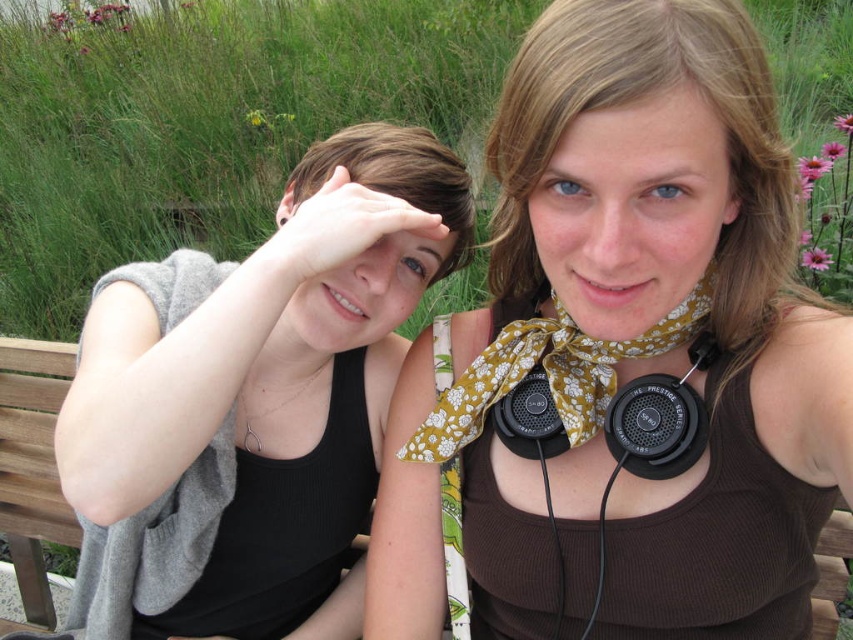
You are standing in the scene and want to hand a jacket to the person wearing the black matte tank top at left. Based on their position, where should you walk to approach them?

The black matte tank top at left is located at point (270, 392), so you should walk towards the coordinates (270, 392) to reach them.

You are an artist sketching the scene and want to focus on the pale skin ear at center. Where exactly should you look on the canvas to find it?

The pale skin ear at center is located at point (730, 209) on the canvas.